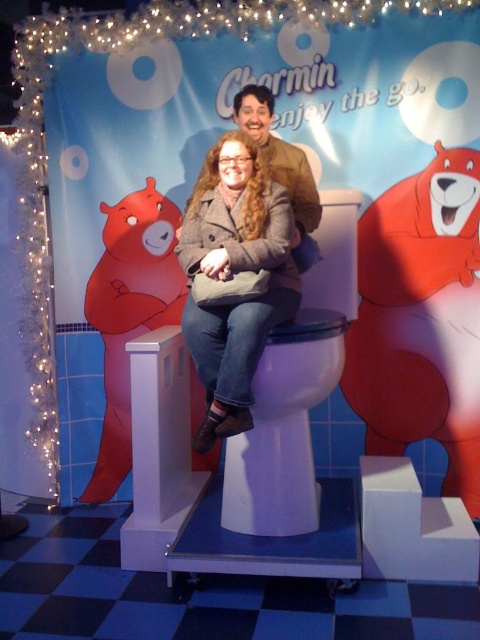
Is matte red bear at center smaller than white glossy toilet bowl at center?

No, matte red bear at center is not smaller than white glossy toilet bowl at center.

Who is positioned more to the left, matte red bear at center or white glossy toilet bowl at center?

white glossy toilet bowl at center is more to the left.

Where is `matte red bear at center`? The width and height of the screenshot is (480, 640). matte red bear at center is located at coordinates (420, 320).

Identify the location of matte red bear at center. (420, 320).

Where is `white glossy toilet bowl at center`? The image size is (480, 640). white glossy toilet bowl at center is located at coordinates (283, 429).

Which of these two, white glossy toilet bowl at center or matte red bear at left, stands shorter?

white glossy toilet bowl at center

Who is more forward, (320, 332) or (117, 212)?

Point (320, 332)

This screenshot has width=480, height=640. In order to click on white glossy toilet bowl at center in this screenshot , I will do `click(283, 429)`.

Can you confirm if matte red bear at center is positioned to the right of matte gray coat at center?

Indeed, matte red bear at center is positioned on the right side of matte gray coat at center.

Who is positioned more to the left, matte red bear at center or matte gray coat at center?

matte gray coat at center

Does point (430, 392) come in front of point (202, 326)?

No.

The image size is (480, 640). Find the location of `matte red bear at center`. matte red bear at center is located at coordinates (420, 320).